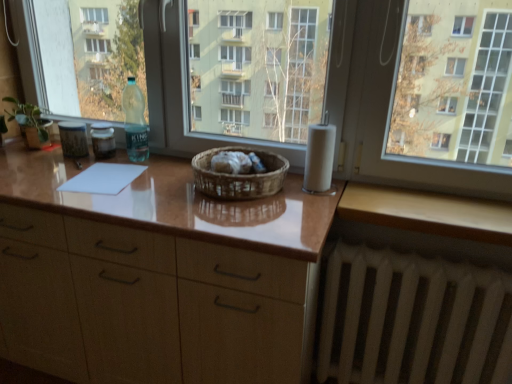
Question: Is green matte plant at left bigger than wooden at lower right?

Choices:
 (A) yes
 (B) no

Answer: (A)

Question: Is green matte plant at left turned away from wooden at lower right?

Choices:
 (A) yes
 (B) no

Answer: (B)

Question: Is green matte plant at left to the right of wooden at lower right from the viewer's perspective?

Choices:
 (A) no
 (B) yes

Answer: (A)

Question: From a real-world perspective, is green matte plant at left on wooden at lower right?

Choices:
 (A) yes
 (B) no

Answer: (A)

Question: Is green matte plant at left to the left of wooden at lower right from the viewer's perspective?

Choices:
 (A) no
 (B) yes

Answer: (B)

Question: From their relative heights in the image, would you say translucent plastic bottle at left is taller or shorter than green matte plant at left?

Choices:
 (A) short
 (B) tall

Answer: (A)

Question: In the image, is translucent plastic bottle at left positioned in front of or behind green matte plant at left?

Choices:
 (A) front
 (B) behind

Answer: (B)

Question: Is translucent plastic bottle at left situated inside green matte plant at left or outside?

Choices:
 (A) outside
 (B) inside

Answer: (A)

Question: From the image's perspective, is translucent plastic bottle at left located above or below green matte plant at left?

Choices:
 (A) above
 (B) below

Answer: (B)

Question: In terms of height, does wooden at lower right look taller or shorter compared to green matte plant at left?

Choices:
 (A) short
 (B) tall

Answer: (A)

Question: From the image's perspective, is wooden at lower right located above or below green matte plant at left?

Choices:
 (A) above
 (B) below

Answer: (B)

Question: In terms of width, does wooden at lower right look wider or thinner when compared to green matte plant at left?

Choices:
 (A) thin
 (B) wide

Answer: (B)

Question: Considering the positions of point (360, 201) and point (23, 109), is point (360, 201) closer or farther from the camera than point (23, 109)?

Choices:
 (A) farther
 (B) closer

Answer: (B)

Question: From the image's perspective, relative to white matte toilet paper at right, is matte brown countertop at center above or below?

Choices:
 (A) below
 (B) above

Answer: (A)

Question: Considering the positions of matte brown countertop at center and white matte toilet paper at right in the image, is matte brown countertop at center wider or thinner than white matte toilet paper at right?

Choices:
 (A) wide
 (B) thin

Answer: (A)